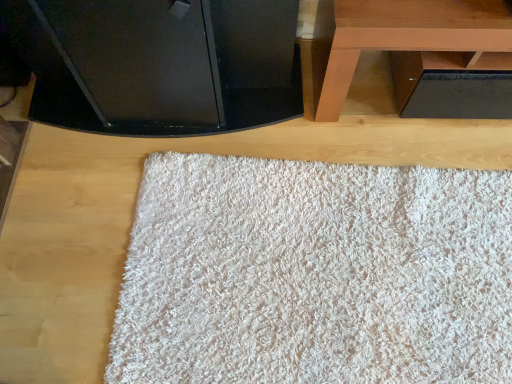
Find the location of a particular element. The height and width of the screenshot is (384, 512). free spot below white fluffy rug at center (from a real-world perspective) is located at coordinates (328, 273).